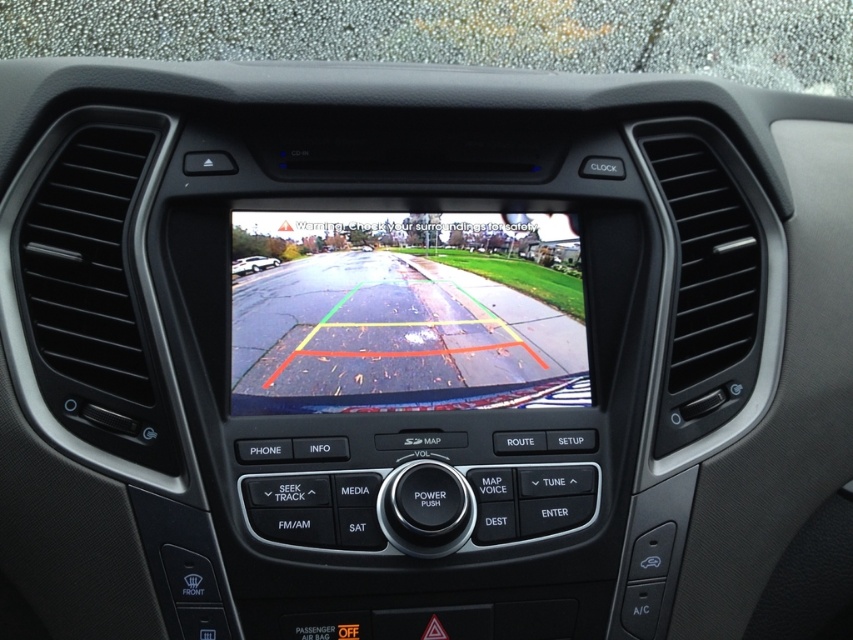
You are a driver checking the rear view camera on your vehicle. You see two points displayed on the screen at coordinates point (566, 284) and point (241, 262). Which point is closer to the camera?

Point (241, 262) is closer to the camera because it has a smaller y coordinate, meaning it is positioned lower on the screen and thus nearer to the camera.

You are a driver about to park your car. You look at the dashboard and see the transparent plastic view mirror at center and the white glossy car at center. Which object on the dashboard appears bigger to you?

The transparent plastic view mirror at center appears larger than the white glossy car at center because it is larger in size.

You are a driver preparing to back up your vehicle. You notice the transparent plastic view mirror at center and the white glossy car at center. Which object is located to the right of the other?

The transparent plastic view mirror at center is positioned on the right side of white glossy car at center, so it is to the right of the car.